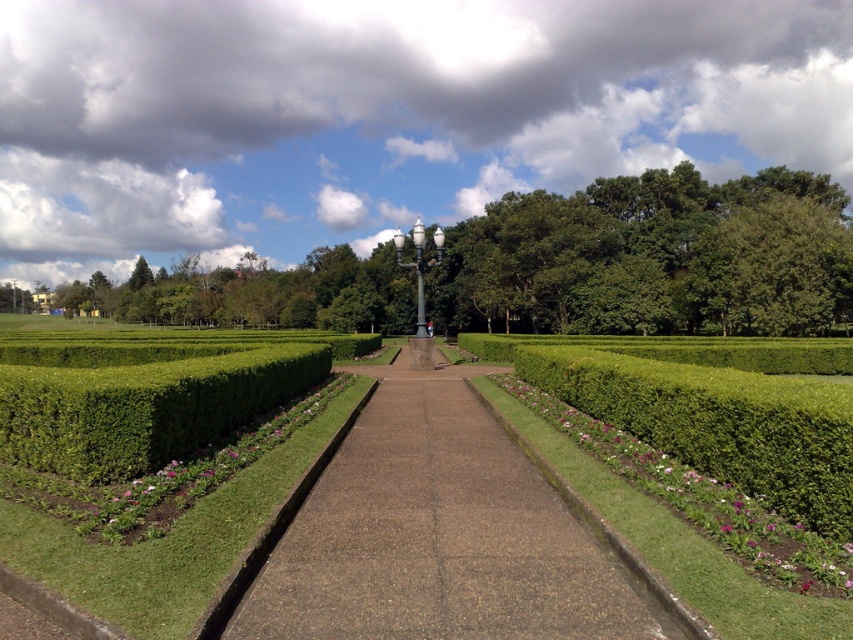
Is point (117, 403) positioned before point (202, 461)?

Yes, it is in front of point (202, 461).

In the scene shown: Who is more forward, (231, 355) or (184, 472)?

Positioned in front is point (184, 472).

Is point (165, 444) positioned before point (143, 476)?

No, it is behind (143, 476).

Where is `green leafy hedge at left`? The width and height of the screenshot is (853, 640). green leafy hedge at left is located at coordinates 142,406.

Who is shorter, purple matte flower at center-right or pink matte flower at lower left?

With less height is pink matte flower at lower left.

Does point (837, 579) come behind point (149, 522)?

No.

What do you see at coordinates (703, 500) in the screenshot?
I see `purple matte flower at center-right` at bounding box center [703, 500].

At what (x,y) coordinates should I click in order to perform the action: click on purple matte flower at center-right. Please return your answer as a coordinate pair (x, y). The image size is (853, 640). Looking at the image, I should click on (703, 500).

Can you confirm if green leafy hedge at left is shorter than green leafy tree at upper right?

Correct, green leafy hedge at left is not as tall as green leafy tree at upper right.

Is green leafy hedge at left to the left of green leafy tree at upper right from the viewer's perspective?

Correct, you'll find green leafy hedge at left to the left of green leafy tree at upper right.

Locate an element on the screen. This screenshot has height=640, width=853. green leafy hedge at left is located at coordinates (142, 406).